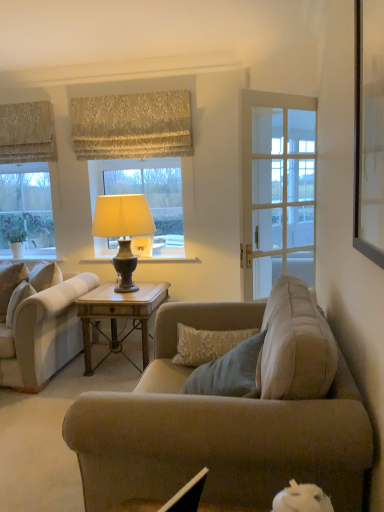
Question: From a real-world perspective, is wooden table at center above or below clear glass window at left, which ranks as the 1th window in left-to-right order?

Choices:
 (A) below
 (B) above

Answer: (A)

Question: From the image's perspective, is wooden table at center above or below clear glass window at left, which ranks as the 1th window in left-to-right order?

Choices:
 (A) below
 (B) above

Answer: (A)

Question: Which of these objects is positioned farthest from the beige textured curtain at upper left, positioned as the 1th curtain in left-to-right order?

Choices:
 (A) gold textured fabric at upper center, the 1th curtain viewed from the right
 (B) clear glass window at left, which ranks as the 1th window in left-to-right order
 (C) white glass window at center, placed as the first window when sorted from right to left
 (D) wooden table at center
 (E) wooden picture frame at upper right

Answer: (E)

Question: Which is nearer to the light beige fabric couch at left?

Choices:
 (A) beige textured curtain at upper left, positioned as the 1th curtain in left-to-right order
 (B) matte cream lampshade at center
 (C) white glass window at center, which appears as the second window when viewed from the left
 (D) clear glass window at left, which ranks as the 1th window in left-to-right order
 (E) gold textured fabric at upper center, the 1th curtain viewed from the right

Answer: (B)